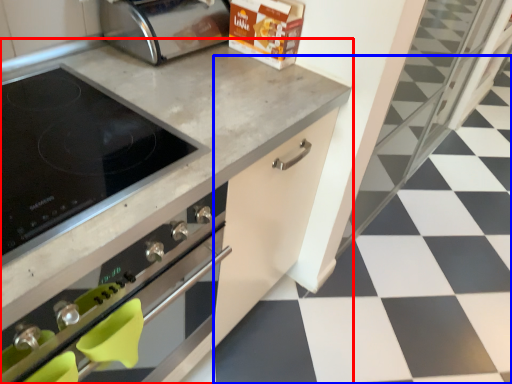
Question: Which object appears closest to the camera in this image, countertop (highlighted by a red box) or tile (highlighted by a blue box)?

Choices:
 (A) countertop
 (B) tile

Answer: (A)